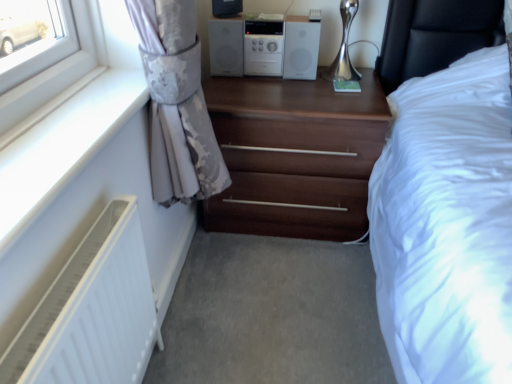
Question: Looking at their shapes, would you say dark wood chest of drawers at center is wider or thinner than white matte radiator at lower left?

Choices:
 (A) thin
 (B) wide

Answer: (B)

Question: In the image, is dark wood chest of drawers at center positioned in front of or behind white matte radiator at lower left?

Choices:
 (A) behind
 (B) front

Answer: (A)

Question: Based on their relative distances, which object is nearer to the dark wood chest of drawers at center?

Choices:
 (A) white plastic stereo at upper center
 (B) white matte radiator at lower left
 (C) silky gray curtain at left
 (D) white plastic radiator at lower left
 (E) matte black speaker at upper center

Answer: (A)

Question: Which object is positioned closest to the white plastic radiator at lower left?

Choices:
 (A) silky gray curtain at left
 (B) matte black speaker at upper center
 (C) white plastic stereo at upper center
 (D) white matte radiator at lower left
 (E) dark wood chest of drawers at center

Answer: (A)